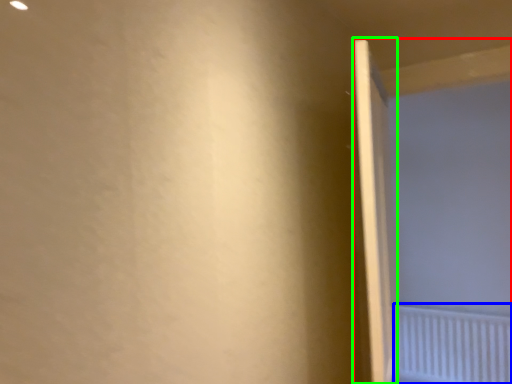
Question: Which object is positioned closest to screen door (highlighted by a red box)? Select from radiator (highlighted by a blue box) and door (highlighted by a green box).

Choices:
 (A) radiator
 (B) door

Answer: (A)